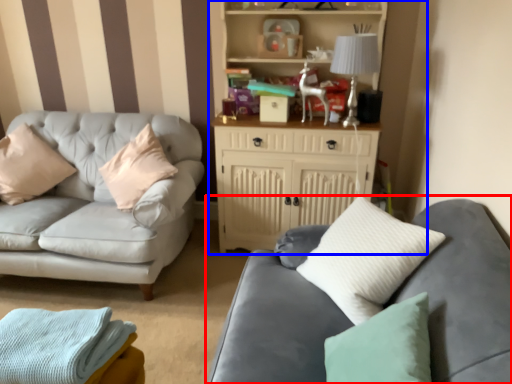
Question: Which object appears farthest to the camera in this image, studio couch (highlighted by a red box) or entertainment center (highlighted by a blue box)?

Choices:
 (A) studio couch
 (B) entertainment center

Answer: (B)